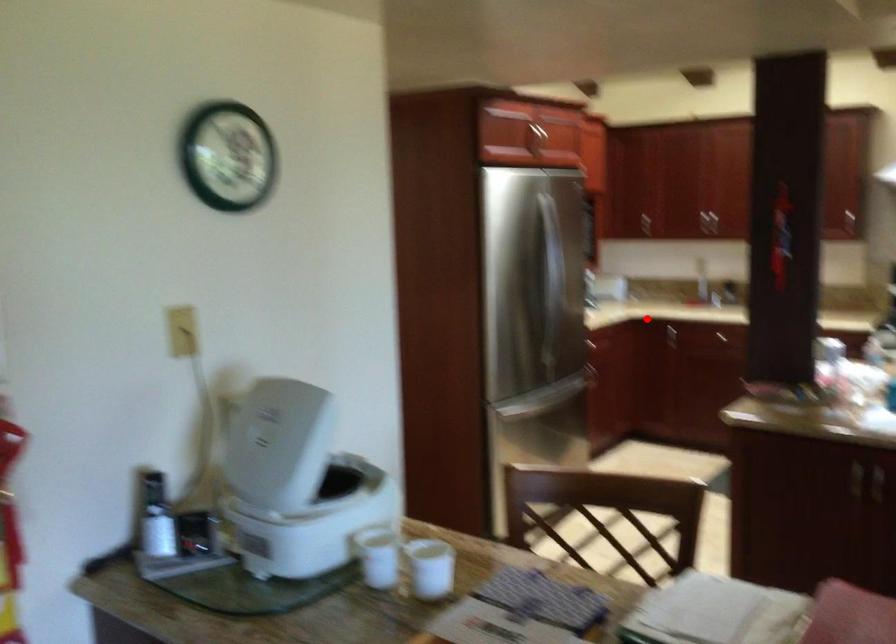
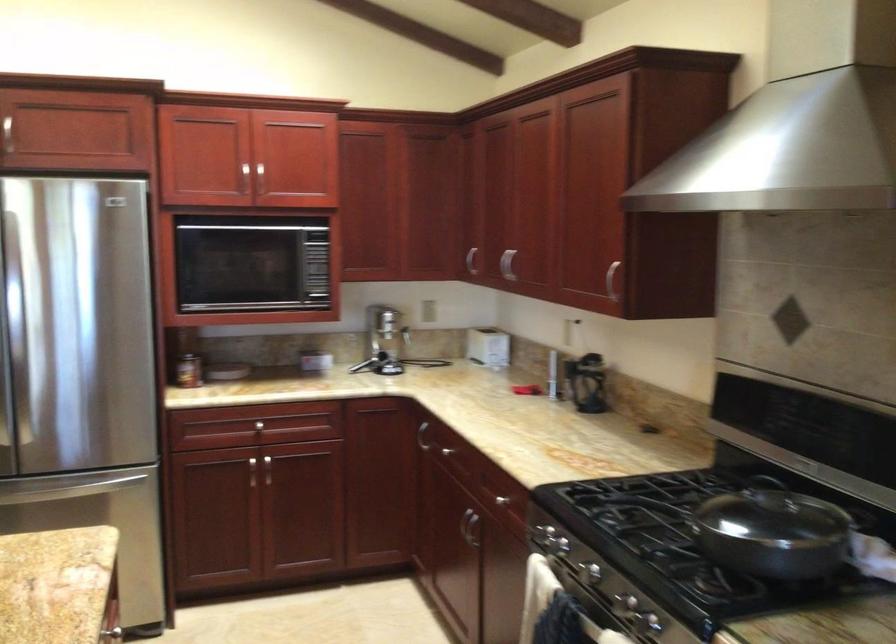
Locate, in the second image, the point that corresponds to the highlighted location in the first image.

(421, 436)